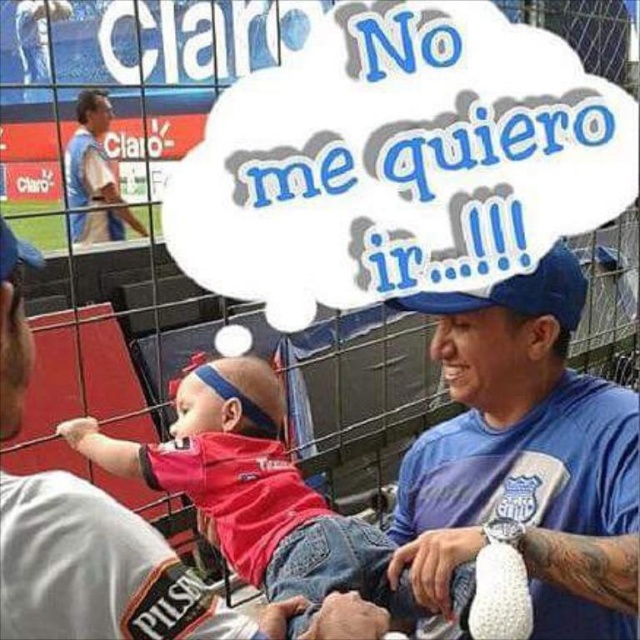
In the scene shown: You are a spectator at the soccer game and want to ensure the baby in the red shirt stays warm during the match. Which of the two shirts, the blue fabric shirt at center or the matte red shirt at center, is more suitable for warmth?

The matte red shirt at center is thicker than the blue fabric shirt at center, making it more suitable for keeping the baby warm.

You are a photographer at the stadium and want to capture a photo of the blue fabric shirt at center and the matte red shirt at center. Which shirt should you focus on first if you want to ensure both are in frame without moving the camera?

The blue fabric shirt at center is taller than the matte red shirt at center, so you should focus on the blue fabric shirt at center first to ensure the entire height of both shirts fits in the frame.